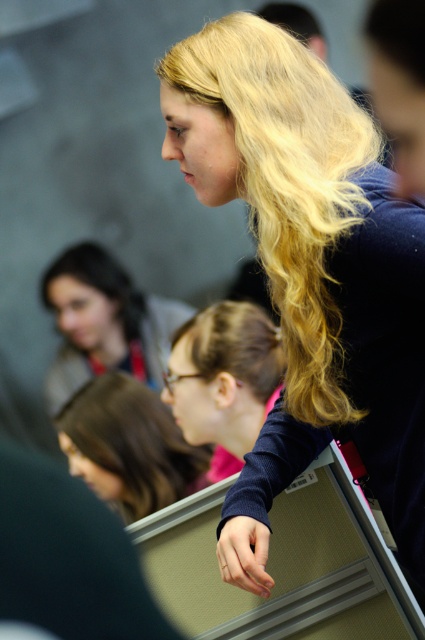
Consider the image. You are a photographer who wants to capture a closeup shot of both the matte black hair at lower center and the blonde hair at lower left. Given that your camera can only focus on objects within a 3 inch range, will you be able to get both in focus?

The matte black hair at lower center and the blonde hair at lower left are 3.06 inches apart from each other. Since the distance between them exceeds the camera focus range of 3 inches, you won not be able to get both in focus simultaneously.

You are a photographer who needs to adjust the lighting for a group photo. You notice two people with brown smooth hair at center and blonde silky hair at center. Which person has hair that is taller?

The brown smooth hair at center is much taller than the blonde silky hair at center, so the person with brown smooth hair at center has taller hair.

You are standing in a classroom and want to reach the point marked at coordinates (235, 365). If you can walk 3 feet per second, how many seconds will it take you to reach that point?

The distance between you and the point marked at coordinates (235, 365) is 7.87 feet. At a walking speed of 3 feet per second, it would take approximately 2.62 seconds to reach the point.